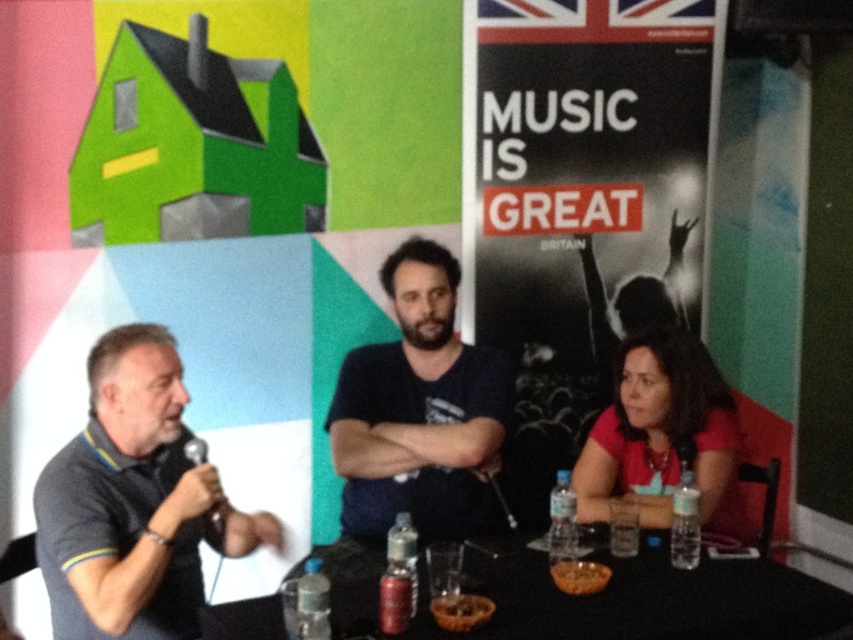
Question: Which of the following is the closest to the observer?

Choices:
 (A) red matte shirt at lower right
 (B) clear plastic cup at lower right
 (C) metallic red can at lower center

Answer: (C)

Question: Is brown textured bowl at lower center thinner than clear plastic cup at lower right?

Choices:
 (A) yes
 (B) no

Answer: (B)

Question: Is gray fabric shirt at left positioned at the back of metallic silver microphone at left?

Choices:
 (A) no
 (B) yes

Answer: (A)

Question: Among these objects, which one is farthest from the camera?

Choices:
 (A) chocolate cake at center
 (B) metallic red can at lower center
 (C) black plastic table at lower center

Answer: (A)

Question: Where is clear plastic bottle at lower right located in relation to brown textured bowl at lower center in the image?

Choices:
 (A) right
 (B) left

Answer: (A)

Question: Which object is closer to the camera taking this photo?

Choices:
 (A) brown textured bowl at lower center
 (B) clear plastic bottle at lower right

Answer: (A)